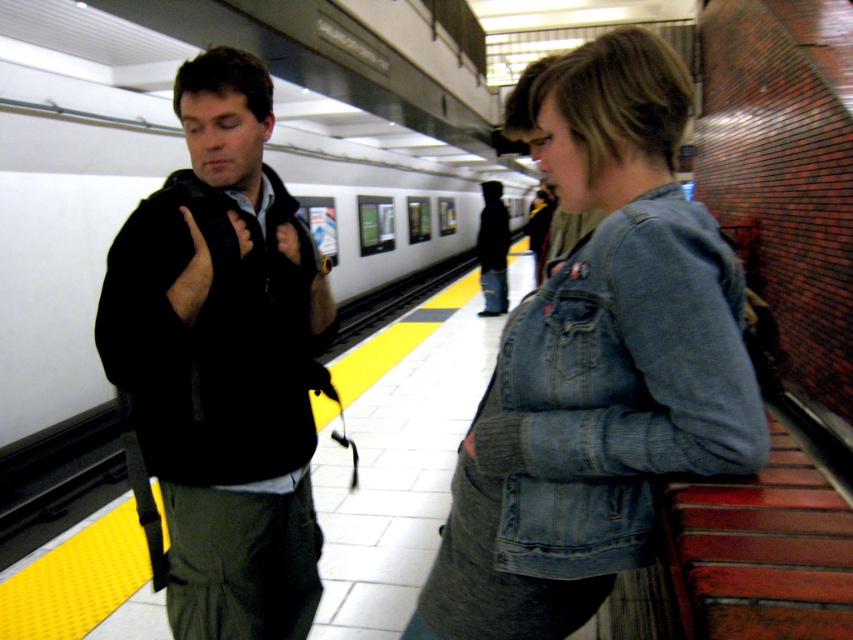
You are a passenger waiting at the subway station platform. You need to locate the black softshell jacket at left. Where exactly is it positioned relative to the platform edge?

The black softshell jacket at left is positioned at point (223, 362) relative to the platform edge.

You are waiting for the subway and want to make sure you have enough space to board the train safely. You notice the black softshell jacket at left and the faded denim jacket at lower right. Which person is closer to the edge of the platform?

The black softshell jacket at left is closer to the edge of the platform than the faded denim jacket at lower right because the faded denim jacket at lower right is positioned behind the black softshell jacket at left.